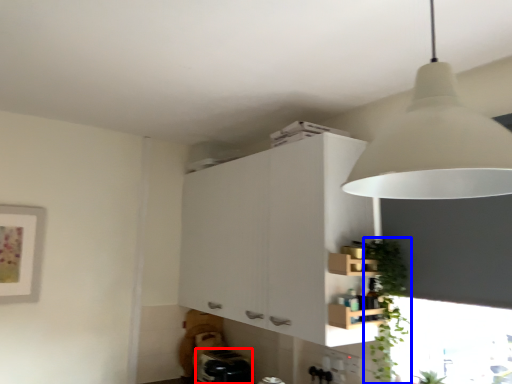
Question: Which of the following is the closest to the observer, appliance (highlighted by a red box) or plant (highlighted by a blue box)?

Choices:
 (A) appliance
 (B) plant

Answer: (B)